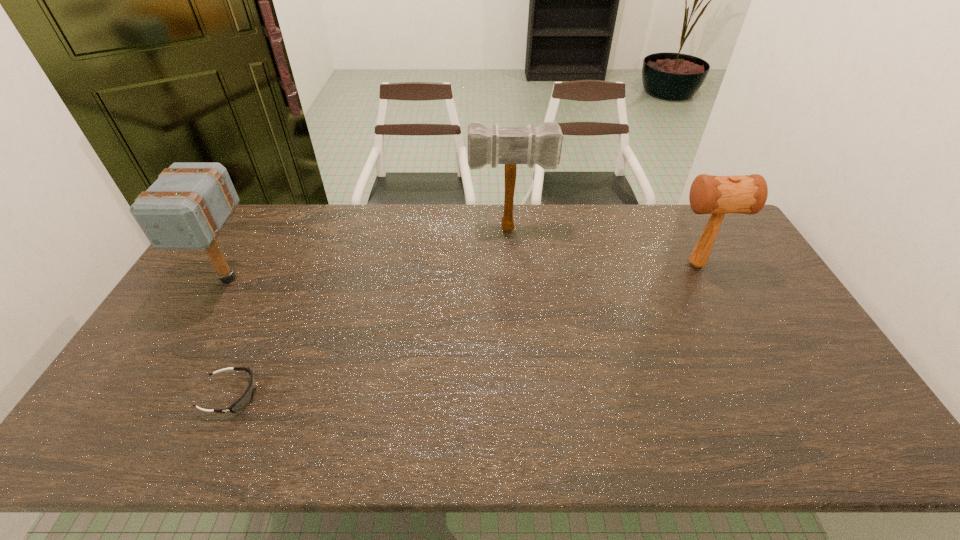
What are the coordinates of `free space located 0.390m on the strike surface of the rightmost object` in the screenshot? It's located at (548, 265).

Locate an element on the screen. The width and height of the screenshot is (960, 540). vacant area situated 0.310m on the front and sides of the third object from right to left is located at coordinates (381, 395).

I want to click on object that is at the far edge, so pyautogui.click(x=494, y=145).

You are a GUI agent. You are given a task and a screenshot of the screen. Output one action in this format:
    pyautogui.click(x=<x>, y=<y>)
    Task: Click on the object that is positioned at the near edge
    
    Given the screenshot: What is the action you would take?
    pyautogui.click(x=245, y=399)

I want to click on object that is at the left edge, so 185,208.

Image resolution: width=960 pixels, height=540 pixels. Find the location of `object that is at the right edge`. object that is at the right edge is located at coordinates (709, 194).

The image size is (960, 540). I want to click on free point at the far edge, so click(637, 210).

Identify the location of free space at the near edge of the desktop. This screenshot has height=540, width=960. (164, 436).

Identify the location of vacant area at the left edge of the desktop. The height and width of the screenshot is (540, 960). (178, 346).

You are a GUI agent. You are given a task and a screenshot of the screen. Output one action in this format:
    pyautogui.click(x=<x>, y=<y>)
    Task: Click on the vacant space at the right edge
    
    Given the screenshot: What is the action you would take?
    pyautogui.click(x=822, y=417)